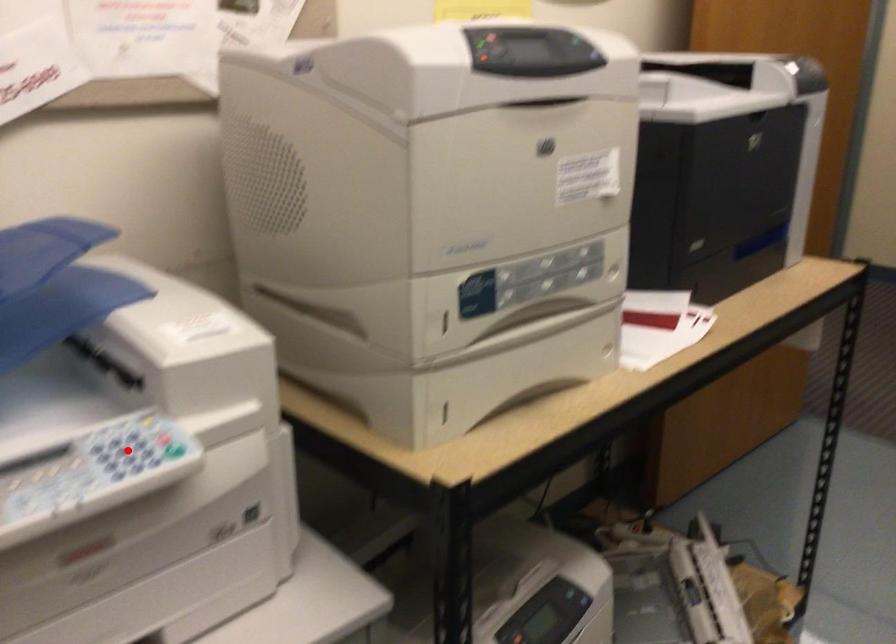
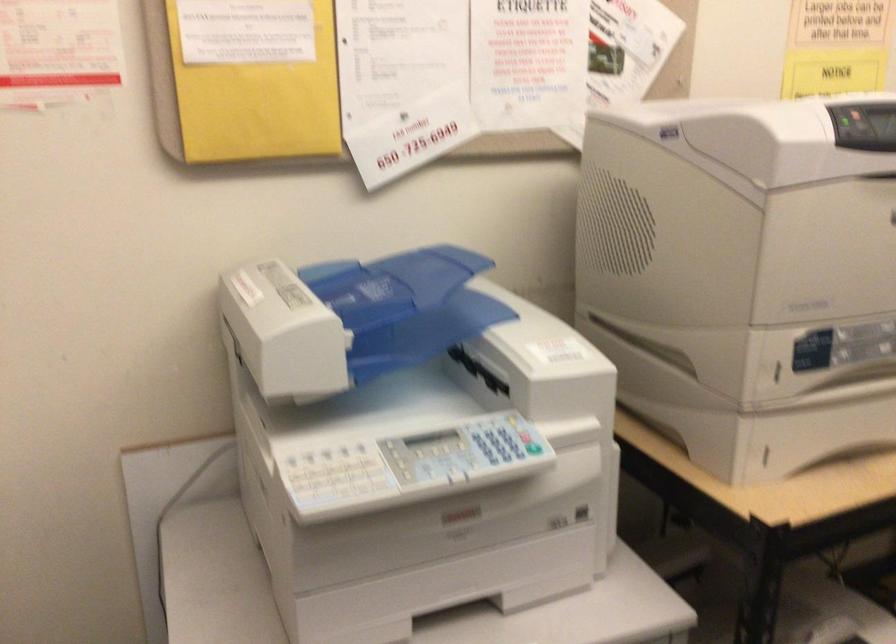
Question: I am providing you with two images of the same scene from different viewpoints. In image1, a red point is highlighted. Considering the same 3D point in image2, which of the following is correct?

Choices:
 (A) It is closer
 (B) It is farther

Answer: (B)